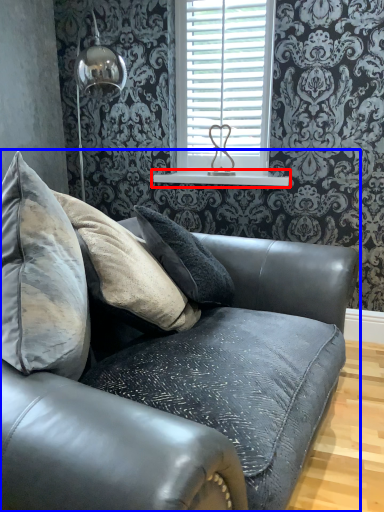
Question: Which point is closer to the camera, window sill (highlighted by a red box) or studio couch (highlighted by a blue box)?

Choices:
 (A) window sill
 (B) studio couch

Answer: (B)